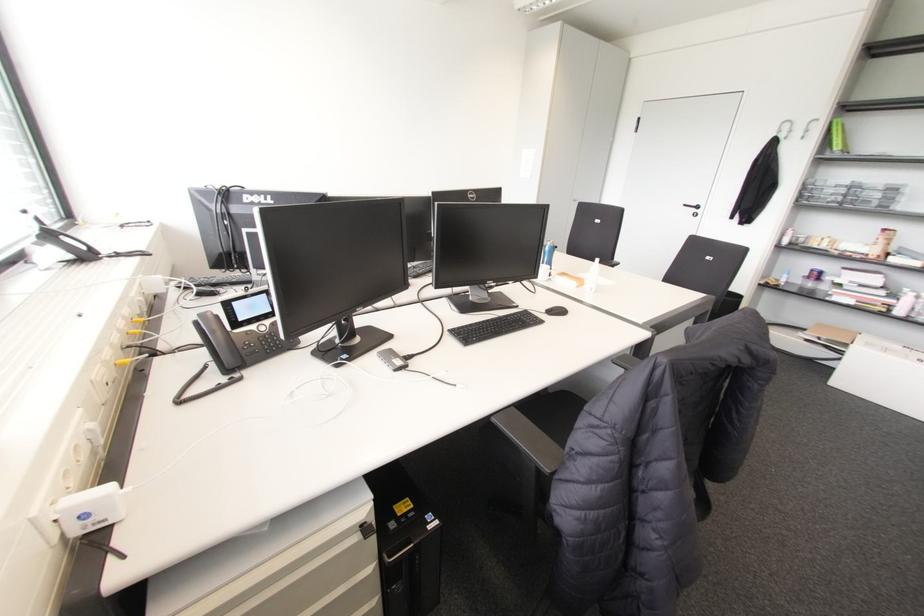
The width and height of the screenshot is (924, 616). I want to click on silver door handle, so click(x=693, y=206).